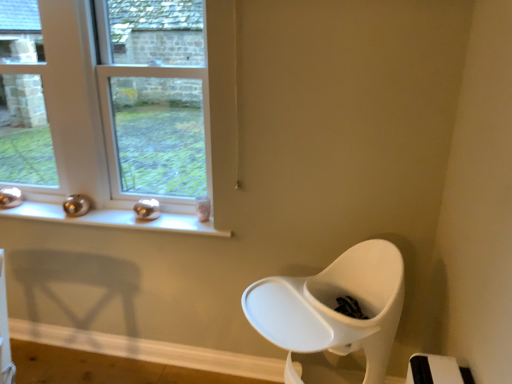
Question: Is clear glass window at upper left, which is the second window from left to right, in contact with clear glass window at left, arranged as the 2th window when viewed from the right?

Choices:
 (A) yes
 (B) no

Answer: (B)

Question: Can you confirm if clear glass window at upper left, positioned as the 1th window in right-to-left order, is shorter than clear glass window at left, the first window when ordered from left to right?

Choices:
 (A) no
 (B) yes

Answer: (B)

Question: Considering the relative positions of clear glass window at upper left, which is the second window from left to right, and clear glass window at left, the first window when ordered from left to right, in the image provided, is clear glass window at upper left, which is the second window from left to right, behind clear glass window at left, the first window when ordered from left to right,?

Choices:
 (A) no
 (B) yes

Answer: (A)

Question: Does clear glass window at upper left, positioned as the 1th window in right-to-left order, have a greater height compared to clear glass window at left, the first window when ordered from left to right?

Choices:
 (A) yes
 (B) no

Answer: (B)

Question: Is the position of clear glass window at upper left, which is the second window from left to right, less distant than that of clear glass window at left, arranged as the 2th window when viewed from the right?

Choices:
 (A) no
 (B) yes

Answer: (B)

Question: Is clear glass window at left, arranged as the 2th window when viewed from the right, spatially inside metallic silver window sill at upper left, or outside of it?

Choices:
 (A) outside
 (B) inside

Answer: (A)

Question: In terms of width, does clear glass window at left, arranged as the 2th window when viewed from the right, look wider or thinner when compared to metallic silver window sill at upper left?

Choices:
 (A) wide
 (B) thin

Answer: (B)

Question: From a real-world perspective, is clear glass window at left, the first window when ordered from left to right, positioned above or below metallic silver window sill at upper left?

Choices:
 (A) below
 (B) above

Answer: (B)

Question: In the image, is clear glass window at left, arranged as the 2th window when viewed from the right, positioned in front of or behind metallic silver window sill at upper left?

Choices:
 (A) behind
 (B) front

Answer: (A)

Question: Considering the positions of clear glass window at upper left, positioned as the 1th window in right-to-left order, and clear glass window at left, the first window when ordered from left to right, in the image, is clear glass window at upper left, positioned as the 1th window in right-to-left order, taller or shorter than clear glass window at left, the first window when ordered from left to right,?

Choices:
 (A) short
 (B) tall

Answer: (A)

Question: Is point (162, 135) closer or farther from the camera than point (40, 79)?

Choices:
 (A) farther
 (B) closer

Answer: (B)

Question: Considering the relative positions of clear glass window at upper left, positioned as the 1th window in right-to-left order, and clear glass window at left, the first window when ordered from left to right, in the image provided, is clear glass window at upper left, positioned as the 1th window in right-to-left order, to the left or to the right of clear glass window at left, the first window when ordered from left to right,?

Choices:
 (A) left
 (B) right

Answer: (B)

Question: From a real-world perspective, is clear glass window at upper left, positioned as the 1th window in right-to-left order, above or below clear glass window at left, the first window when ordered from left to right?

Choices:
 (A) above
 (B) below

Answer: (A)

Question: Considering the positions of point (35, 72) and point (134, 18), is point (35, 72) closer or farther from the camera than point (134, 18)?

Choices:
 (A) closer
 (B) farther

Answer: (A)

Question: Is clear glass window at left, arranged as the 2th window when viewed from the right, to the left or to the right of clear glass window at upper left, positioned as the 1th window in right-to-left order, in the image?

Choices:
 (A) left
 (B) right

Answer: (A)